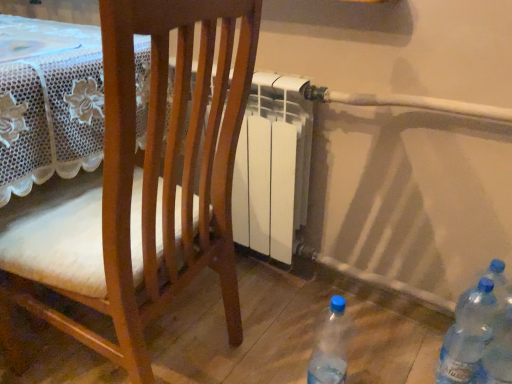
Locate an element on the screen. The width and height of the screenshot is (512, 384). vacant area to the right of transparent plastic bottle at lower right, marked as the first bottle in a left-to-right arrangement is located at coordinates (381, 365).